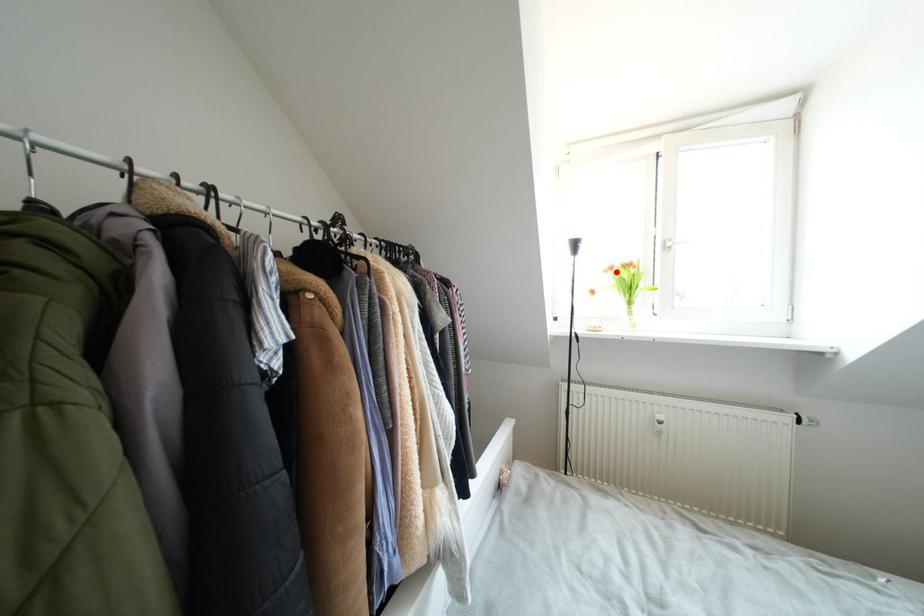
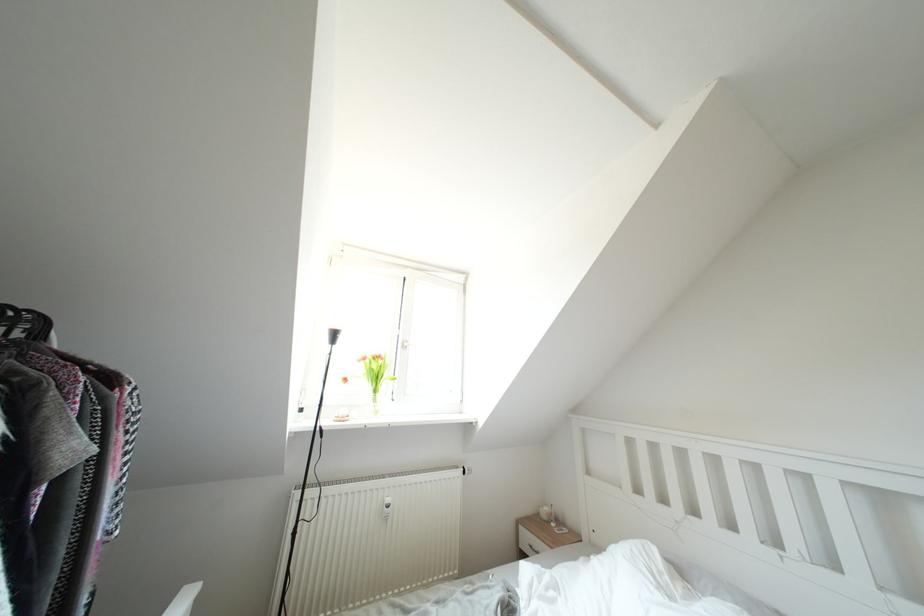
Question: I am providing you with two images of the same scene from different viewpoints. Image1 has a red point marked. In image2, the corresponding 3D location appears at what relative position? Reply with the corresponding letter.

Choices:
 (A) Closer
 (B) Farther

Answer: (B)